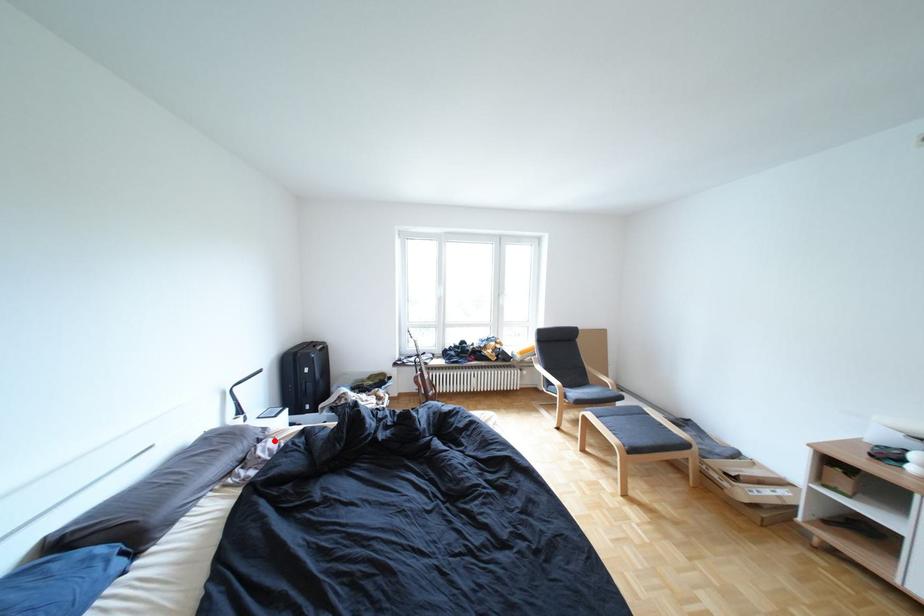
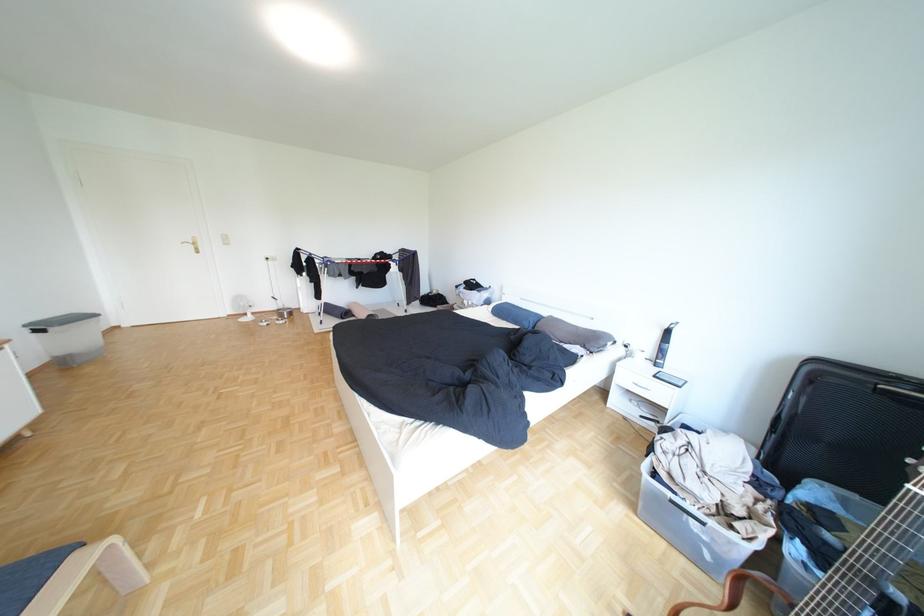
Locate, in the second image, the point that corresponds to the highlighted location in the first image.

(600, 347)